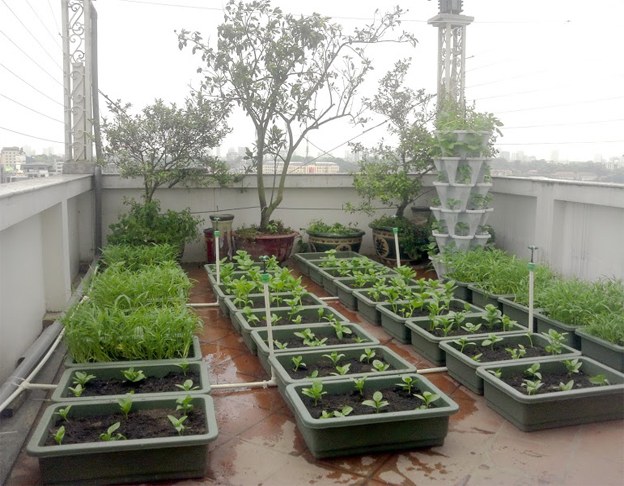
Where is `pot`? Image resolution: width=624 pixels, height=486 pixels. pot is located at coordinates (275, 243), (329, 245), (388, 241).